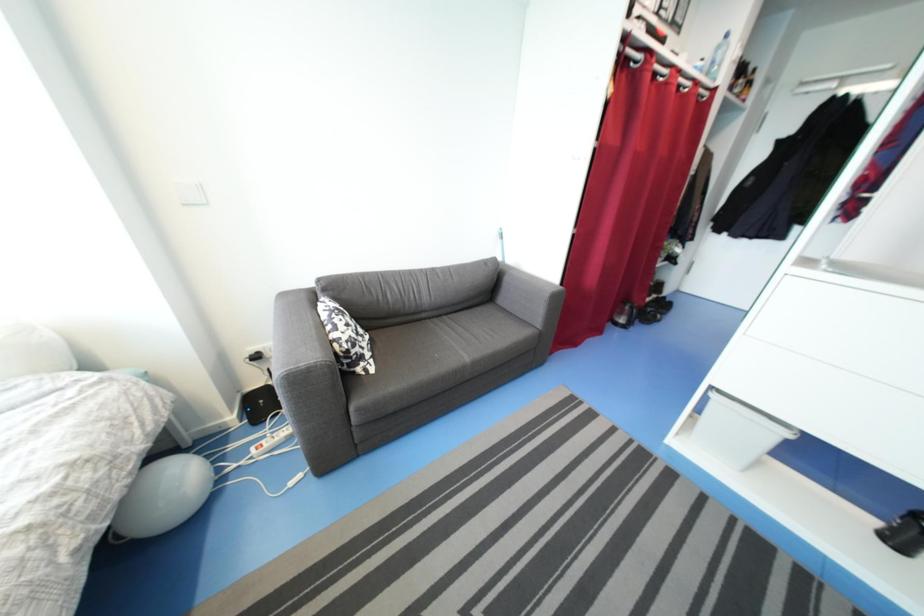
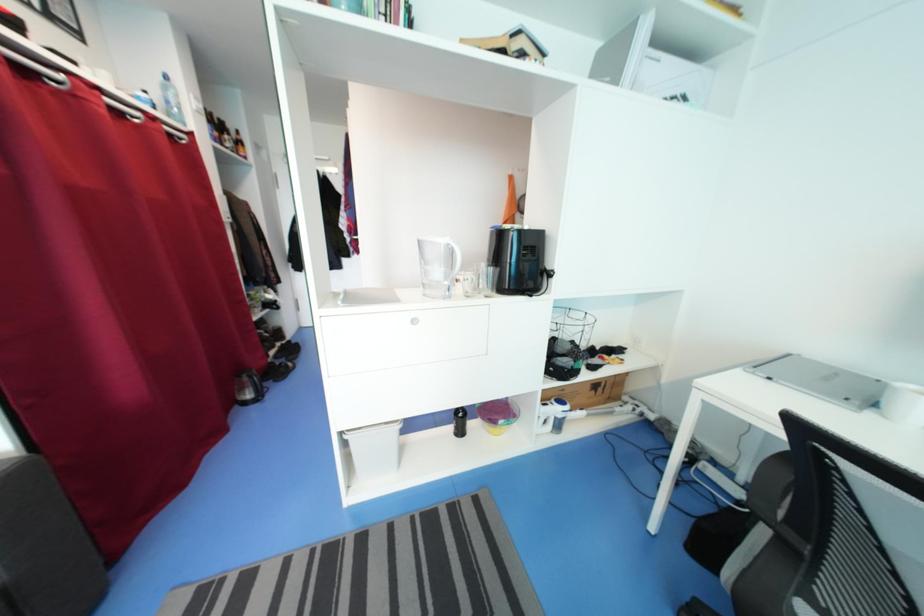
Question: How did the camera likely rotate?

Choices:
 (A) Left
 (B) Right
 (C) Up
 (D) Down

Answer: (B)